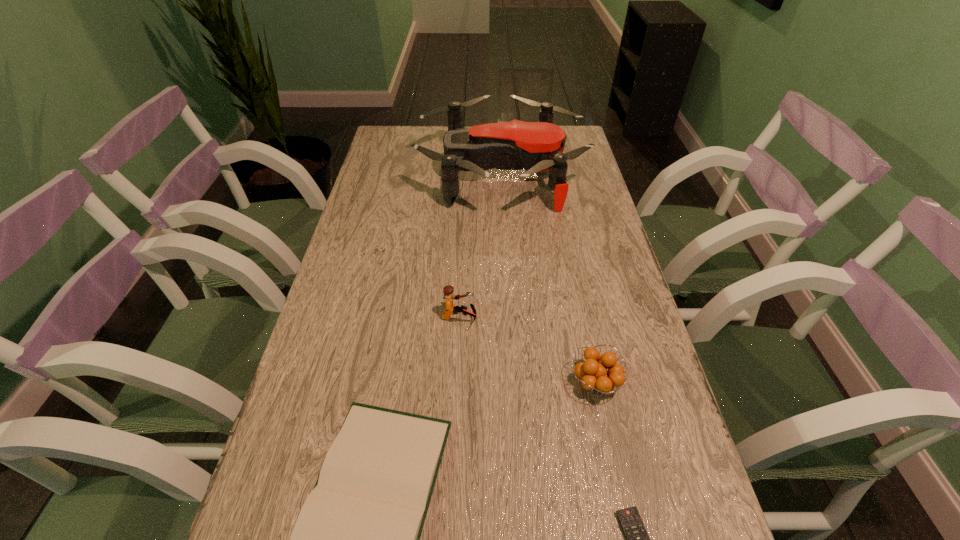
Locate which object is the third closest to the fourth tallest object. Please provide its 2D coordinates. Your answer should be formatted as a tuple, i.e. [(x, y)], where the tuple contains the x and y coordinates of a point satisfying the conditions above.

[(637, 539)]

Identify which object is located as the second nearest to the hardback book. Please provide its 2D coordinates. Your answer should be formatted as a tuple, i.e. [(x, y)], where the tuple contains the x and y coordinates of a point satisfying the conditions above.

[(595, 377)]

In order to click on free region that satisfies the following two spatial constraints: 1. holding a crossbow in the hands of the fourth nearest object; 2. on the back side of the third shortest object in this screenshot , I will do `click(457, 383)`.

I want to click on vacant space that satisfies the following two spatial constraints: 1. on the back side of the orange fruit; 2. holding a crossbow in the hands of the Lego, so click(x=581, y=318).

Locate an element on the screen. The height and width of the screenshot is (540, 960). vacant space that satisfies the following two spatial constraints: 1. on the camera side of the farthest object; 2. on the right side of the third shortest object is located at coordinates (513, 383).

Where is `free space that satisfies the following two spatial constraints: 1. on the back side of the orange fruit; 2. holding a crossbow in the hands of the Lego`? free space that satisfies the following two spatial constraints: 1. on the back side of the orange fruit; 2. holding a crossbow in the hands of the Lego is located at coordinates (581, 318).

The width and height of the screenshot is (960, 540). I want to click on vacant area that satisfies the following two spatial constraints: 1. on the camera side of the orange fruit; 2. on the right side of the drone, so click(513, 383).